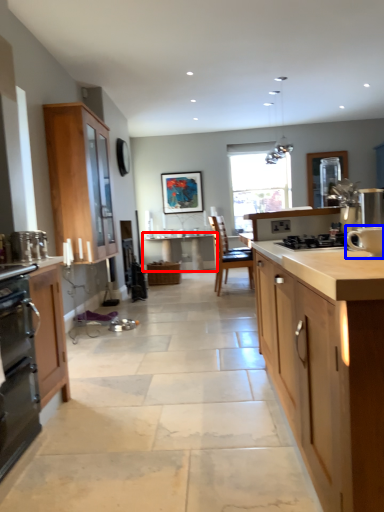
Question: Which object is further to the camera taking this photo, table (highlighted by a red box) or appliance (highlighted by a blue box)?

Choices:
 (A) table
 (B) appliance

Answer: (A)